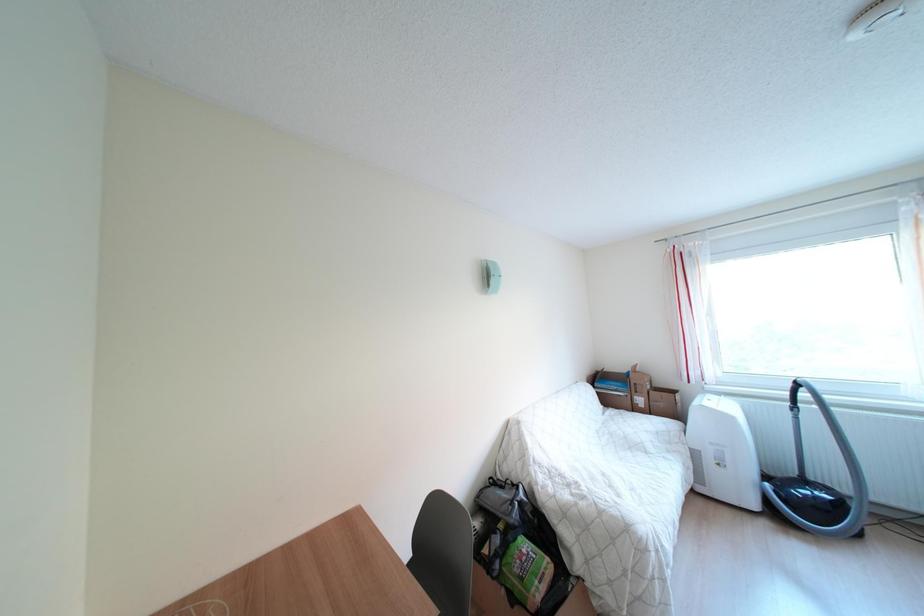
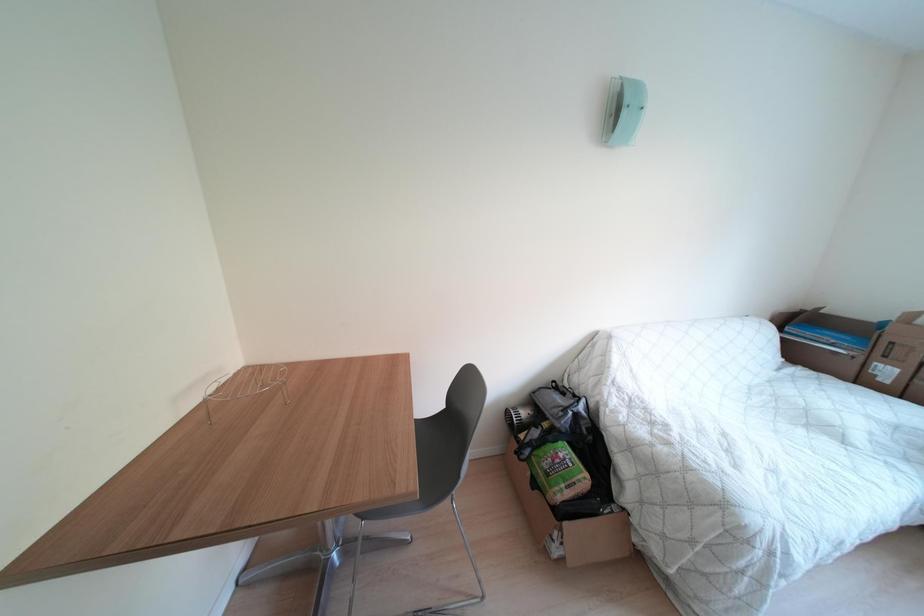
Based on the continuous images, in which direction is the camera rotating?

The rotation direction of the camera is left-down.